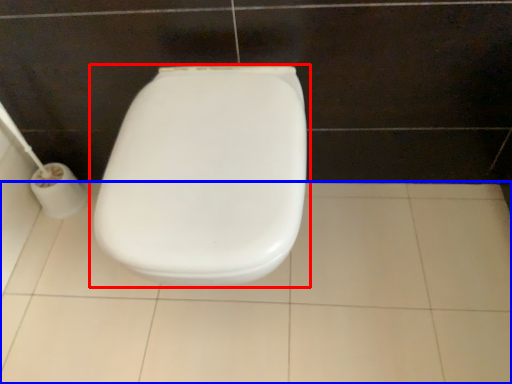
Question: Which object appears farthest to the camera in this image, toilet (highlighted by a red box) or ceramic tile (highlighted by a blue box)?

Choices:
 (A) toilet
 (B) ceramic tile

Answer: (B)